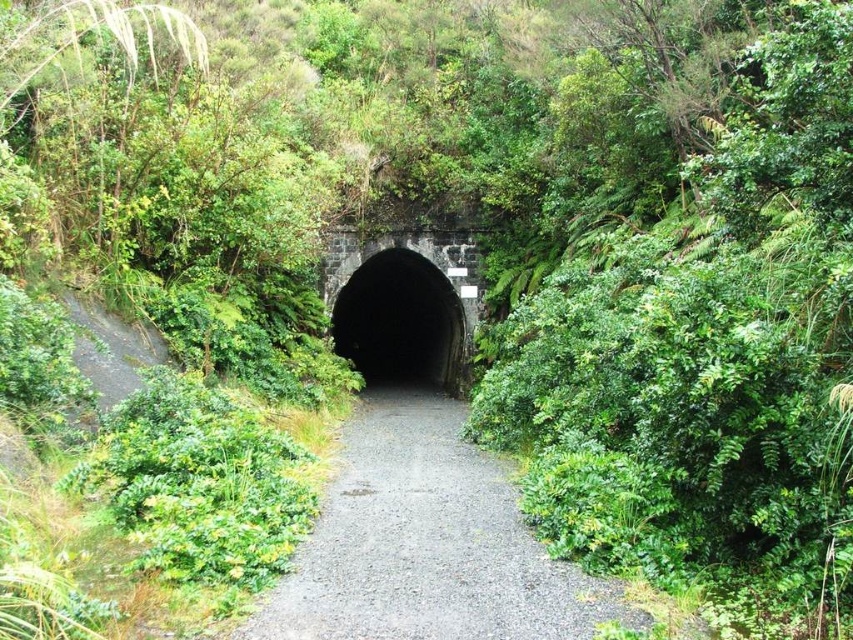
You are planning to walk through the tunnel entrance. The gray gravel path at center leads to the black stone tunnel at center. Which one is narrower, the path or the tunnel entrance?

The gray gravel path at center has a smaller size compared to the black stone tunnel at center, so the path is narrower than the tunnel entrance.

You are a hiker standing at the entrance of the tunnel. You see the gray gravel path at center and the black stone tunnel at center. Which object is closer to your feet?

The gray gravel path at center is closer to your feet since it is located below the black stone tunnel at center.

You are standing at the entrance of the tunnel and want to walk along the path. Based on the image, where exactly is the gray gravel path at center located in terms of coordinates?

The gray gravel path at center is located at coordinates point (426, 544).